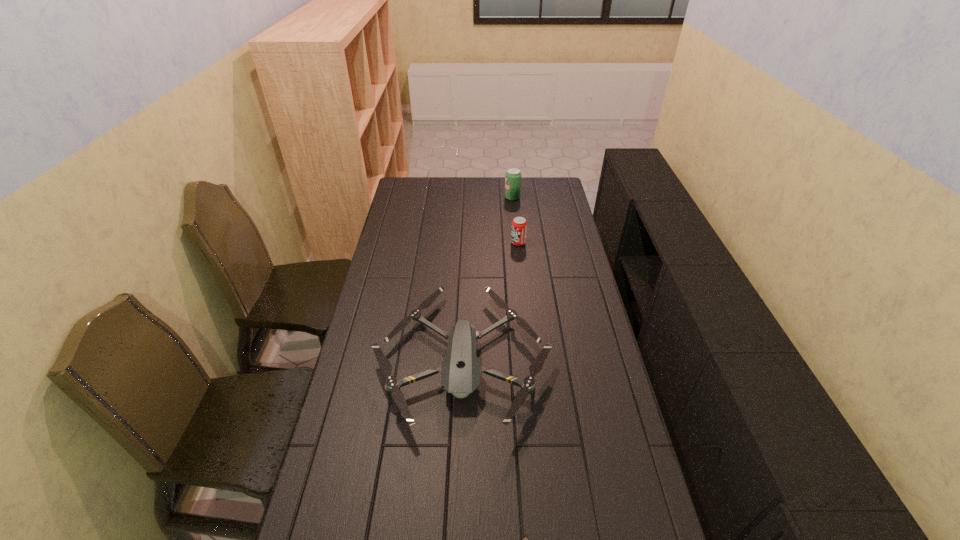
The width and height of the screenshot is (960, 540). I want to click on blank space located with a camera mounted on the front of the third farthest object, so pyautogui.click(x=459, y=459).

Identify the location of object positioned at the far edge. (513, 175).

Where is `object located in the left edge section of the desktop`? The height and width of the screenshot is (540, 960). object located in the left edge section of the desktop is located at coordinates (460, 370).

Image resolution: width=960 pixels, height=540 pixels. In the image, there is a desktop. Identify the location of vacant space at the left edge. (400, 241).

Locate an element on the screen. vacant space at the right edge of the desktop is located at coordinates (616, 534).

This screenshot has height=540, width=960. Find the location of `vacant space at the far left corner`. vacant space at the far left corner is located at coordinates (402, 181).

In the image, there is a desktop. Where is `vacant space at the far right corner`? The image size is (960, 540). vacant space at the far right corner is located at coordinates (534, 179).

Identify the location of the closest object relative to the tallest object. (519, 225).

Select which object is the second closest to the third farthest object. Please provide its 2D coordinates. Your answer should be formatted as a tuple, i.e. [(x, y)], where the tuple contains the x and y coordinates of a point satisfying the conditions above.

[(519, 225)]